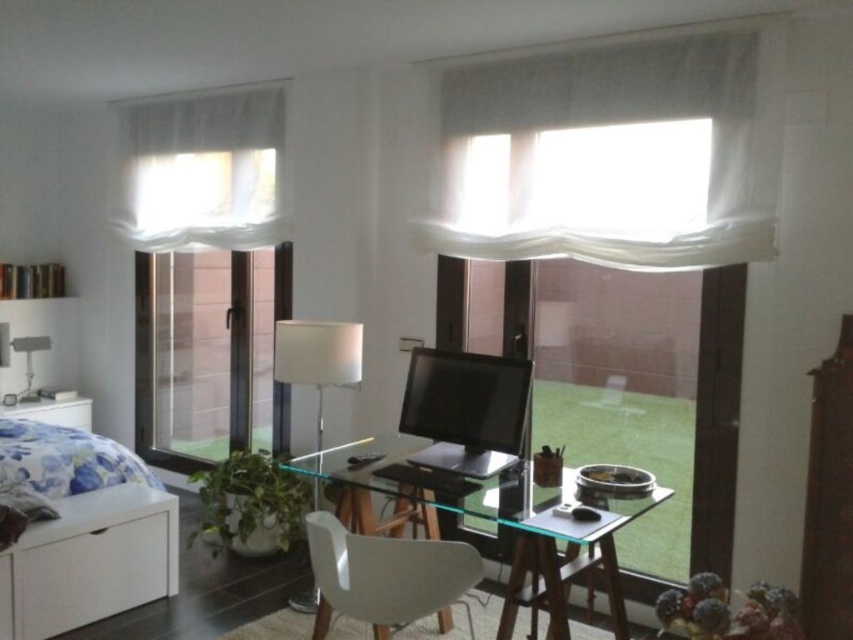
Which is in front, point (572, 99) or point (35, 417)?

Positioned in front is point (572, 99).

Is point (492, 214) positioned in front of point (73, 428)?

Yes, point (492, 214) is closer to viewer.

Which is in front, point (448, 99) or point (51, 410)?

Point (448, 99) is more forward.

Locate an element on the screen. This screenshot has width=853, height=640. white sheer curtain at upper center is located at coordinates (612, 154).

Which is more to the right, white sheer curtain at upper center or transparent glass door at center?

From the viewer's perspective, white sheer curtain at upper center appears more on the right side.

Can you confirm if white sheer curtain at upper center is smaller than transparent glass door at center?

Indeed, white sheer curtain at upper center has a smaller size compared to transparent glass door at center.

Who is more distant from viewer, (688, 253) or (173, 456)?

Point (173, 456)

Where is `white sheer curtain at upper center`? This screenshot has height=640, width=853. white sheer curtain at upper center is located at coordinates (612, 154).

Is point (74, 461) closer to viewer compared to point (165, 230)?

Yes, point (74, 461) is closer to viewer.

Does white matte bed at lower left have a lesser height compared to white sheer curtain at upper left?

Correct, white matte bed at lower left is not as tall as white sheer curtain at upper left.

Identify the location of white matte bed at lower left. This screenshot has width=853, height=640. (83, 531).